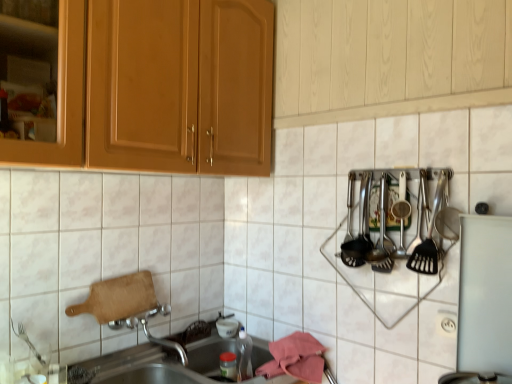
Describe the element at coordinates (338, 223) in the screenshot. I see `white glossy tile at upper center` at that location.

Measure the distance between point (438, 323) and camera.

The depth of point (438, 323) is 4.44 feet.

Where is `metallic stainless steel sink at lower left`? metallic stainless steel sink at lower left is located at coordinates (159, 363).

The width and height of the screenshot is (512, 384). What do you see at coordinates (359, 225) in the screenshot? I see `polished stainless steel utensils at right, acting as the 1th silverware starting from the left` at bounding box center [359, 225].

The image size is (512, 384). What are the coordinates of `polished stainless steel utensils at right, which appears as the 1th silverware when viewed from the back` in the screenshot? It's located at (359, 225).

Locate an element on the screen. This screenshot has height=384, width=512. white glossy tile at upper center is located at coordinates (338, 223).

Can you confirm if polished stainless steel utensils at right, which appears as the second silverware when viewed from the right, is wider than polished stainless steel utensils at right, which is the second silverware from left to right?

No, polished stainless steel utensils at right, which appears as the second silverware when viewed from the right, is not wider than polished stainless steel utensils at right, which is the second silverware from left to right.

Is the position of polished stainless steel utensils at right, which appears as the 1th silverware when viewed from the back, more distant than that of polished stainless steel utensils at right, which is the second silverware from left to right?

Yes, polished stainless steel utensils at right, which appears as the 1th silverware when viewed from the back, is further from the viewer.

How different are the orientations of polished stainless steel utensils at right, which is counted as the 2th silverware, starting from the front, and polished stainless steel utensils at right, arranged as the first silverware when viewed from the right, in degrees?

There is a 1.42-degree angle between the facing directions of polished stainless steel utensils at right, which is counted as the 2th silverware, starting from the front, and polished stainless steel utensils at right, arranged as the first silverware when viewed from the right.

From a real-world perspective, which is physically below, white glossy tile at upper center or polished stainless steel utensils at right, acting as the 1th silverware starting from the left?

white glossy tile at upper center.

Is white glossy tile at upper center touching polished stainless steel utensils at right, which is counted as the 2th silverware, starting from the front?

No, white glossy tile at upper center is not next to polished stainless steel utensils at right, which is counted as the 2th silverware, starting from the front.

From the image's perspective, would you say white glossy tile at upper center is shown under polished stainless steel utensils at right, which appears as the second silverware when viewed from the right?

Yes, from the image's perspective, white glossy tile at upper center is beneath polished stainless steel utensils at right, which appears as the second silverware when viewed from the right.

Is white glossy tile at upper center turned away from polished stainless steel utensils at right, which appears as the second silverware when viewed from the right?

Yes, polished stainless steel utensils at right, which appears as the second silverware when viewed from the right, is at the back of white glossy tile at upper center.

How many degrees apart are the facing directions of polished stainless steel utensils at right, which appears as the 1th silverware when viewed from the back, and white plastic electric outlet at lower right?

There is a 1.38-degree angle between the facing directions of polished stainless steel utensils at right, which appears as the 1th silverware when viewed from the back, and white plastic electric outlet at lower right.

This screenshot has height=384, width=512. I want to click on the 2nd silverware directly above the white plastic electric outlet at lower right (from a real-world perspective), so click(359, 225).

Which of these two, polished stainless steel utensils at right, which appears as the 1th silverware when viewed from the back, or white plastic electric outlet at lower right, is thinner?

white plastic electric outlet at lower right is thinner.

Does point (350, 225) appear closer or farther from the camera than point (441, 332)?

Point (350, 225).

From the image's perspective, is metallic stainless steel sink at lower left above or below white plastic electric outlet at lower right?

metallic stainless steel sink at lower left is below white plastic electric outlet at lower right.

Considering the sizes of metallic stainless steel sink at lower left and white plastic electric outlet at lower right in the image, is metallic stainless steel sink at lower left taller or shorter than white plastic electric outlet at lower right?

Considering their sizes, metallic stainless steel sink at lower left has more height than white plastic electric outlet at lower right.

You are a GUI agent. You are given a task and a screenshot of the screen. Output one action in this format:
    pyautogui.click(x=<x>, y=<y>)
    Task: Click on the electric outlet that is above the metallic stainless steel sink at lower left (from the image's perspective)
    This screenshot has height=384, width=512.
    Given the screenshot: What is the action you would take?
    pyautogui.click(x=446, y=323)

Is metallic stainless steel sink at lower left at the right side of white plastic electric outlet at lower right?

No, metallic stainless steel sink at lower left is not to the right of white plastic electric outlet at lower right.

Are white plastic electric outlet at lower right and polished stainless steel utensils at right, which is the second silverware from left to right, making contact?

No, white plastic electric outlet at lower right is not touching polished stainless steel utensils at right, which is the second silverware from left to right.

Considering the relative sizes of white plastic electric outlet at lower right and polished stainless steel utensils at right, marked as the second silverware in a back-to-front arrangement, in the image provided, is white plastic electric outlet at lower right shorter than polished stainless steel utensils at right, marked as the second silverware in a back-to-front arrangement,?

Yes.

From a real-world perspective, which object stands above the other?

From a 3D spatial view, polished stainless steel utensils at right, marked as the second silverware in a back-to-front arrangement, is above.

Is point (251, 234) in front of point (441, 176)?

That is False.

Which is correct: white glossy tile at upper center is inside polished stainless steel utensils at right, which is the second silverware from left to right, or outside of it?

white glossy tile at upper center exists outside the volume of polished stainless steel utensils at right, which is the second silverware from left to right.

Who is shorter, white glossy tile at upper center or polished stainless steel utensils at right, which is the second silverware from left to right?

Standing shorter between the two is polished stainless steel utensils at right, which is the second silverware from left to right.

Locate an element on the screen. This screenshot has width=512, height=384. tile beneath the polished stainless steel utensils at right, arranged as the first silverware when viewed from the right (from a real-world perspective) is located at coordinates (338, 223).

Can you tell me how much white plastic electric outlet at lower right and white glossy tile at upper center differ in facing direction?

The facing directions of white plastic electric outlet at lower right and white glossy tile at upper center are 6.61 degrees apart.

Which of these two, white plastic electric outlet at lower right or white glossy tile at upper center, is wider?

white glossy tile at upper center.

From a real-world perspective, is white plastic electric outlet at lower right positioned above or below white glossy tile at upper center?

In terms of real-world spatial position, white plastic electric outlet at lower right is below white glossy tile at upper center.

Does white plastic electric outlet at lower right have a lesser height compared to white glossy tile at upper center?

Yes.

The width and height of the screenshot is (512, 384). Identify the location of silverware that is on the right side of polished stainless steel utensils at right, which appears as the 1th silverware when viewed from the back. (429, 238).

You are a GUI agent. You are given a task and a screenshot of the screen. Output one action in this format:
    pyautogui.click(x=<x>, y=<y>)
    Task: Click on the tile lying in front of the polished stainless steel utensils at right, which appears as the second silverware when viewed from the right
    The height and width of the screenshot is (384, 512).
    Given the screenshot: What is the action you would take?
    pyautogui.click(x=338, y=223)

When comparing their distances from metallic stainless steel sink at lower left, does white plastic electric outlet at lower right or polished stainless steel utensils at right, acting as the 1th silverware starting from the left, seem closer?

The object closer to metallic stainless steel sink at lower left is polished stainless steel utensils at right, acting as the 1th silverware starting from the left.

Which object lies nearer to the anchor point polished stainless steel utensils at right, which appears as the 1th silverware when viewed from the back, white plastic electric outlet at lower right or white glossy tile at upper center?

white glossy tile at upper center is positioned closer to the anchor polished stainless steel utensils at right, which appears as the 1th silverware when viewed from the back.

Which object lies further to the anchor point metallic stainless steel sink at lower left, polished stainless steel utensils at right, acting as the 1th silverware starting from the left, or white glossy tile at upper center?

polished stainless steel utensils at right, acting as the 1th silverware starting from the left, is further to metallic stainless steel sink at lower left.

From the image, which object appears to be farther from white glossy tile at upper center, metallic stainless steel sink at lower left or white plastic electric outlet at lower right?

white plastic electric outlet at lower right lies further to white glossy tile at upper center than the other object.

Looking at the image, which one is located closer to polished stainless steel utensils at right, the 1th silverware from the front, white glossy tile at upper center or white plastic electric outlet at lower right?

white plastic electric outlet at lower right lies closer to polished stainless steel utensils at right, the 1th silverware from the front, than the other object.

Looking at the image, which one is located further to white plastic electric outlet at lower right, polished stainless steel utensils at right, marked as the second silverware in a back-to-front arrangement, or metallic stainless steel sink at lower left?

Among the two, metallic stainless steel sink at lower left is located further to white plastic electric outlet at lower right.

Which object lies further to the anchor point polished stainless steel utensils at right, acting as the 1th silverware starting from the left, metallic stainless steel sink at lower left or white glossy tile at upper center?

metallic stainless steel sink at lower left.

Considering their positions, is white glossy tile at upper center positioned further to white plastic electric outlet at lower right than metallic stainless steel sink at lower left?

metallic stainless steel sink at lower left lies further to white plastic electric outlet at lower right than the other object.

You are a GUI agent. You are given a task and a screenshot of the screen. Output one action in this format:
    pyautogui.click(x=<x>, y=<y>)
    Task: Click on the silverware between white glossy tile at upper center and polished stainless steel utensils at right, the 1th silverware from the front
    The height and width of the screenshot is (384, 512).
    Given the screenshot: What is the action you would take?
    pyautogui.click(x=359, y=225)

What are the coordinates of `tile between polished stainless steel utensils at right, acting as the 1th silverware starting from the left, and metallic stainless steel sink at lower left in the up-down direction` in the screenshot? It's located at (338, 223).

At what (x,y) coordinates should I click in order to perform the action: click on tile situated between metallic stainless steel sink at lower left and polished stainless steel utensils at right, the 1th silverware from the front, from left to right. Please return your answer as a coordinate pair (x, y). Looking at the image, I should click on (338, 223).

Where is `tile between metallic stainless steel sink at lower left and white plastic electric outlet at lower right`? This screenshot has width=512, height=384. tile between metallic stainless steel sink at lower left and white plastic electric outlet at lower right is located at coordinates (338, 223).